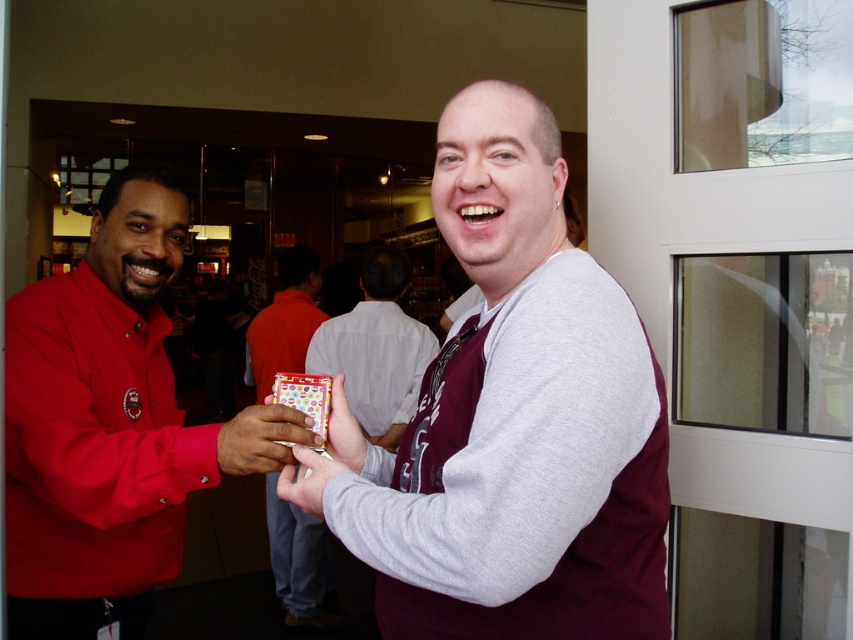
Question: From the image, what is the correct spatial relationship of maroon tie at center in relation to matte red shirt at left?

Choices:
 (A) right
 (B) left

Answer: (A)

Question: Which of the following is the farthest from the observer?

Choices:
 (A) matte plastic card at center
 (B) maroon tie at center
 (C) matte plastic ring at center

Answer: (A)

Question: Which object is positioned farthest from the matte red shirt at left?

Choices:
 (A) light gray cotton shirt at center
 (B) metallic gold card at center
 (C) metallic card at center
 (D) maroon tie at center

Answer: (C)

Question: Can you confirm if light gray cotton shirt at center is wider than matte plastic ring at center?

Choices:
 (A) no
 (B) yes

Answer: (B)

Question: From the image, what is the correct spatial relationship of matte plastic card at center in relation to metallic gold card at center?

Choices:
 (A) below
 (B) above

Answer: (B)

Question: Which object is the closest to the matte plastic phone at center?

Choices:
 (A) metallic gold card at center
 (B) matte red shirt at left
 (C) light gray cotton shirt at center

Answer: (A)